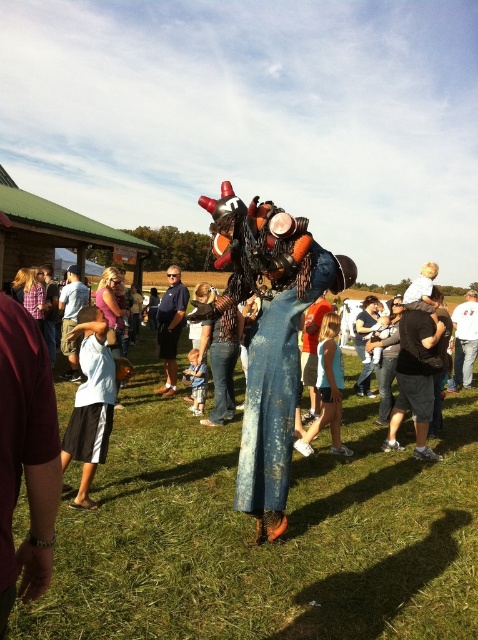
Which of these two, white cotton shirt at lower left or dark blue jeans at center, stands taller?

Standing taller between the two is dark blue jeans at center.

Can you confirm if white cotton shirt at lower left is positioned below dark blue jeans at center?

Yes.

Between point (85, 380) and point (172, 330), which one is positioned in front?

Point (85, 380) is more forward.

Where is `white cotton shirt at lower left`? This screenshot has height=640, width=478. white cotton shirt at lower left is located at coordinates (91, 404).

Is green grass at center above white cotton shirt at lower left?

Actually, green grass at center is below white cotton shirt at lower left.

Can you confirm if green grass at center is positioned to the left of white cotton shirt at lower left?

In fact, green grass at center is to the right of white cotton shirt at lower left.

Who is more forward, (459,451) or (106,454)?

Positioned in front is point (106,454).

Identify the location of green grass at center. This screenshot has height=640, width=478. (264, 545).

Between point (110, 392) and point (467, 340), which one is positioned behind?

Positioned behind is point (467, 340).

Between point (98, 401) and point (455, 348), which one is positioned in front?

Point (98, 401) is more forward.

Does point (84, 339) come closer to viewer compared to point (457, 324)?

Yes, point (84, 339) is in front of point (457, 324).

Find the location of a particular element. This screenshot has height=640, width=478. white cotton shirt at lower left is located at coordinates (91, 404).